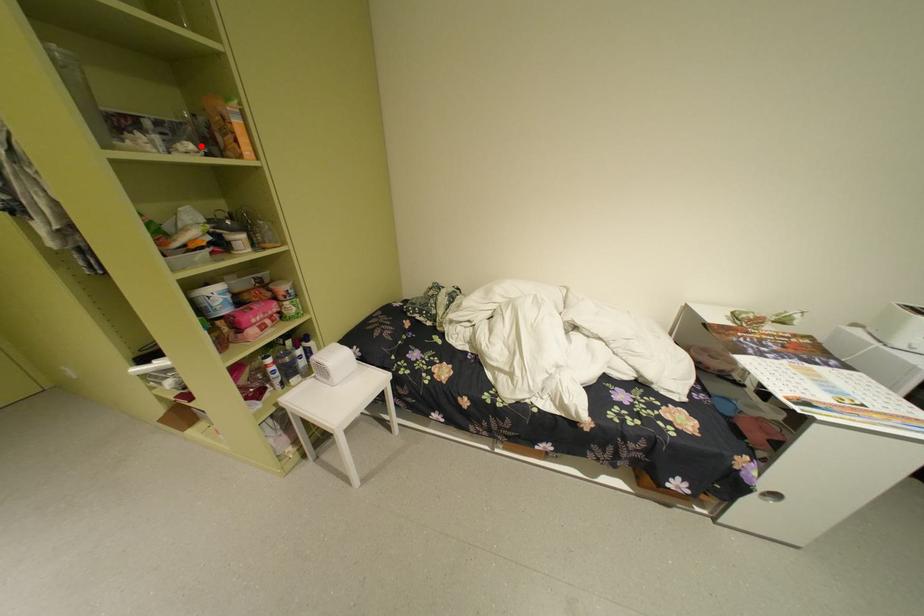
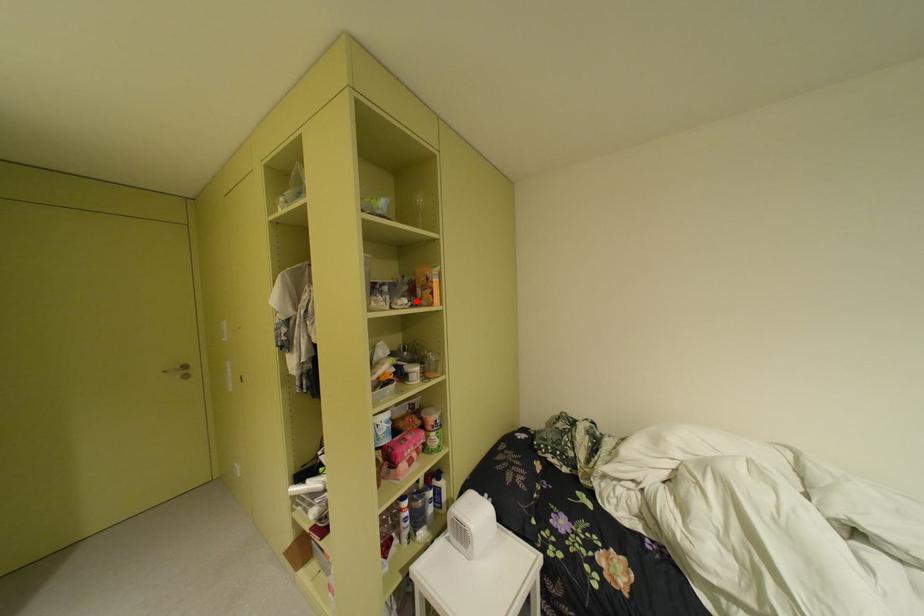
I am providing you with two images of the same scene from different viewpoints. A red point is marked on the first image and another point is marked on the second image. Is the marked point in image1 the same physical position as the marked point in image2?

Yes